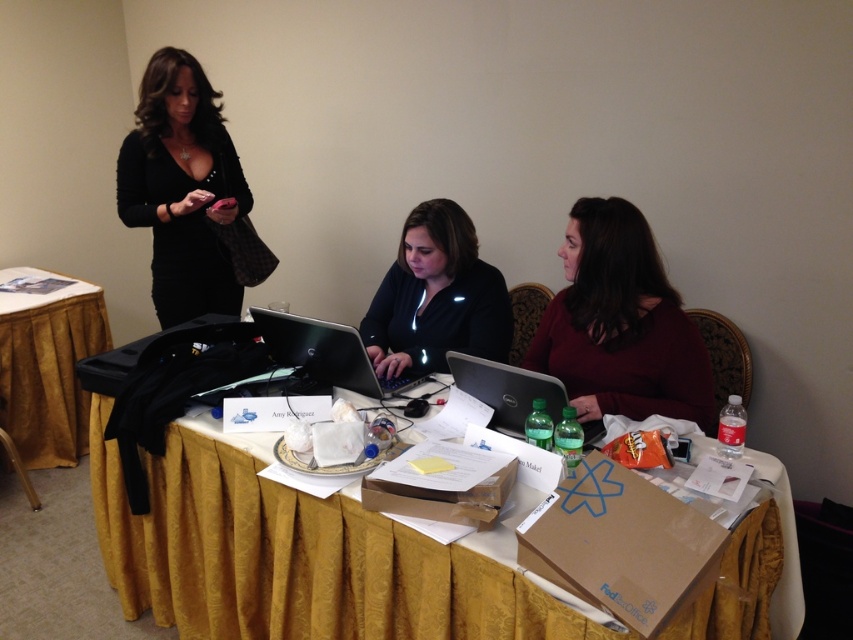
You are organizing a closet and need to decide which item takes up less space horizontally. Which is thinner between the burgundy sweater at center and the black matte dress at upper left?

The burgundy sweater at center is thinner than the black matte dress at upper left, so it takes up less horizontal space.

You are organizing items on a table and need to place the black matte dress at upper left and the black matte laptop at center. Considering their sizes, which item should you place first to ensure stability?

The black matte dress at upper left is much taller than the black matte laptop at center. Since it is taller, you should place the black matte dress at upper left first to ensure stability, then place the black matte laptop at center on top or beside it.

You are a delivery person who needs to place a package on the nearest available surface to the black matte laptop at center. The gold fabric table at lower left is one of the options. Can you determine which surface is closer to the laptop?

The black matte laptop at center is 5.76 feet away from the gold fabric table at lower left. Since the question mentions the gold fabric table at lower left as one of the options, but there might be other surfaces not mentioned, the closest available surface would depend on their distances. However, based on the provided information, the gold fabric table at lower left is 5.76 feet away from the laptop. Without knowing the distance to other surfaces, it cannot be determined which is closer.